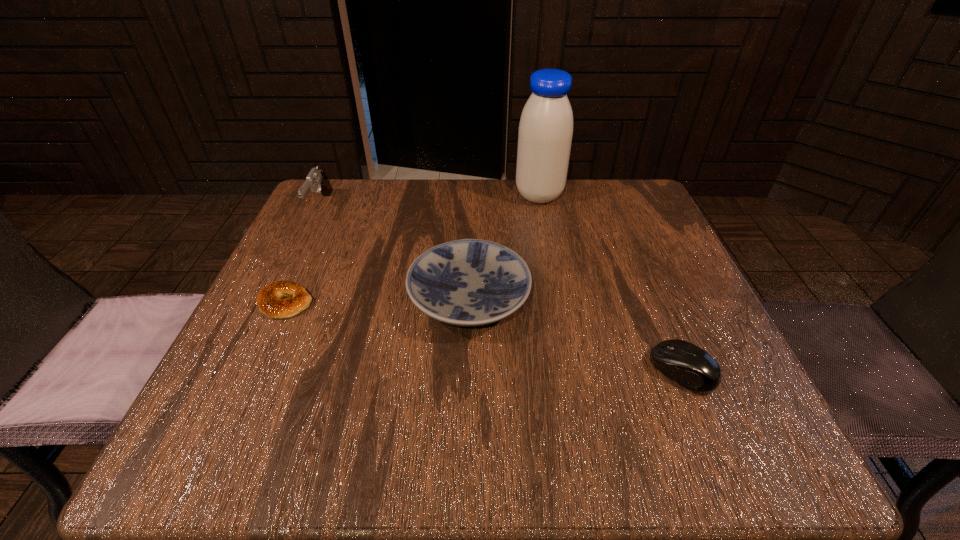
Where is `object that stands as the fourth closest to the tallest object`? The image size is (960, 540). object that stands as the fourth closest to the tallest object is located at coordinates (269, 301).

Identify the location of blank space that satisfies the following two spatial constraints: 1. on the back side of the tallest object; 2. on the right side of the third tallest object. This screenshot has height=540, width=960. (472, 195).

I want to click on free spot that satisfies the following two spatial constraints: 1. on the front side of the nearest object; 2. on the left side of the shortest object, so (254, 370).

Locate an element on the screen. The image size is (960, 540). free space that satisfies the following two spatial constraints: 1. on the front side of the third shortest object; 2. on the left side of the nearest object is located at coordinates (468, 370).

Find the location of a particular element. This screenshot has height=540, width=960. vacant area that satisfies the following two spatial constraints: 1. on the front side of the shortest object; 2. on the right side of the second shortest object is located at coordinates (254, 370).

In order to click on blank area in the image that satisfies the following two spatial constraints: 1. at the muzzle of the fourth shortest object; 2. on the left side of the nearest object in this screenshot , I will do `click(241, 370)`.

The image size is (960, 540). I want to click on free point that satisfies the following two spatial constraints: 1. at the muzzle of the fourth shortest object; 2. on the left side of the rightmost object, so click(241, 370).

Identify the location of vacant space that satisfies the following two spatial constraints: 1. at the muzzle of the gun; 2. on the left side of the plate. (276, 299).

Locate an element on the screen. vacant space that satisfies the following two spatial constraints: 1. at the muzzle of the second tallest object; 2. on the right side of the fourth tallest object is located at coordinates coord(241,370).